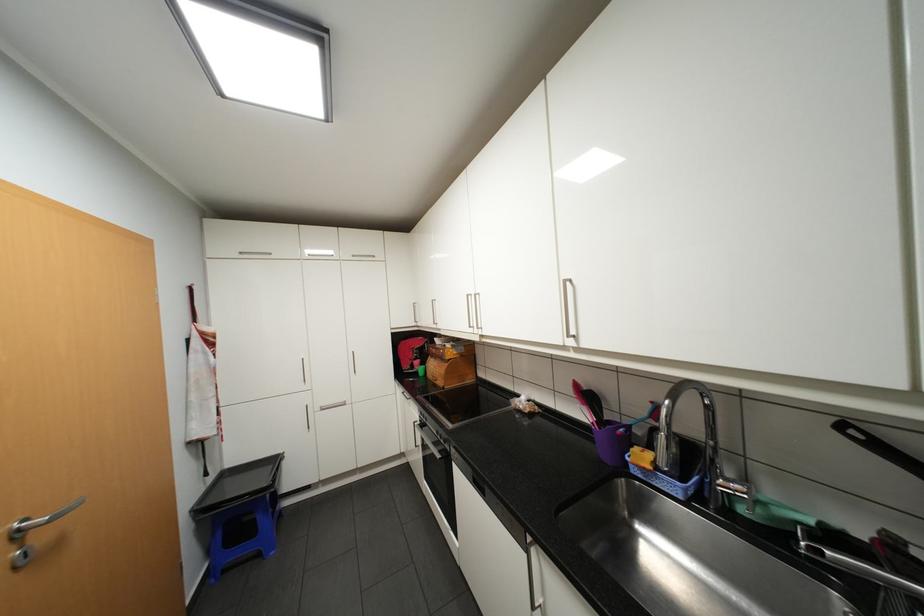
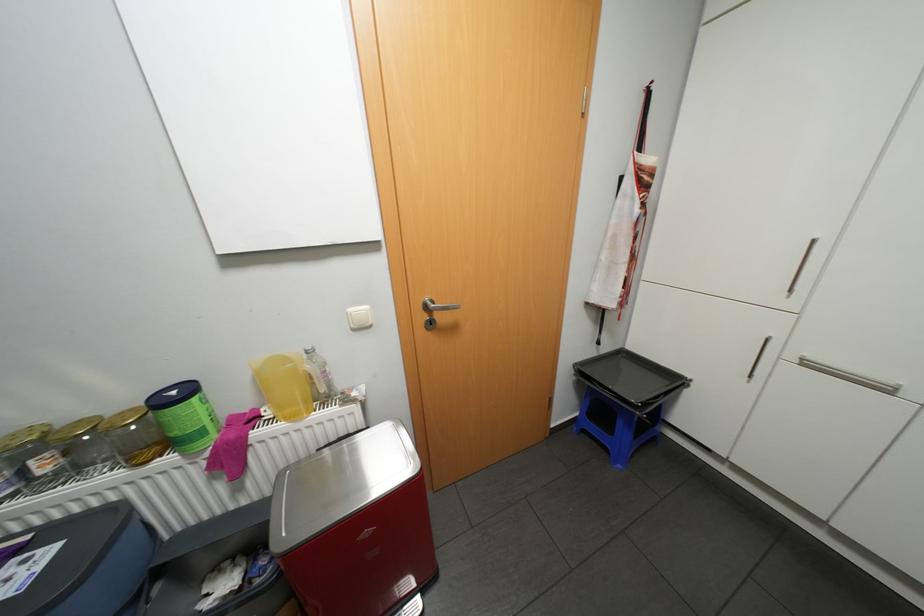
Find the pixel in the second image that matches point 331,408 in the first image.

(813, 363)